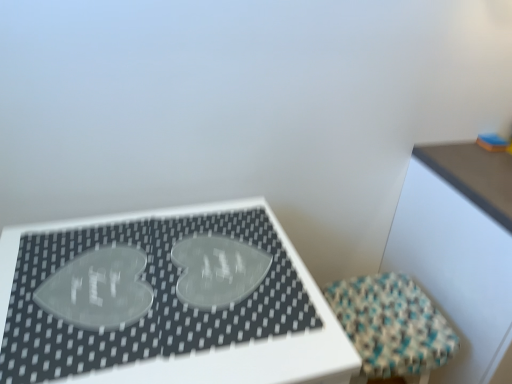
Question: From the image's perspective, is textured woven stool at lower right located above or below transparent pet heart at center, marked as the second table in a right-to-left arrangement?

Choices:
 (A) above
 (B) below

Answer: (B)

Question: Visually, is textured woven stool at lower right positioned to the left or to the right of transparent pet heart at center, placed as the 1th table when sorted from left to right?

Choices:
 (A) right
 (B) left

Answer: (A)

Question: Which object is positioned farthest from the wooden table at upper right, the first table when ordered from right to left?

Choices:
 (A) textured woven stool at lower right
 (B) transparent pet heart at center, marked as the second table in a right-to-left arrangement

Answer: (B)

Question: Based on their relative distances, which object is nearer to the transparent pet heart at center, placed as the 1th table when sorted from left to right?

Choices:
 (A) textured woven stool at lower right
 (B) wooden table at upper right, the 2th table when ordered from left to right

Answer: (A)